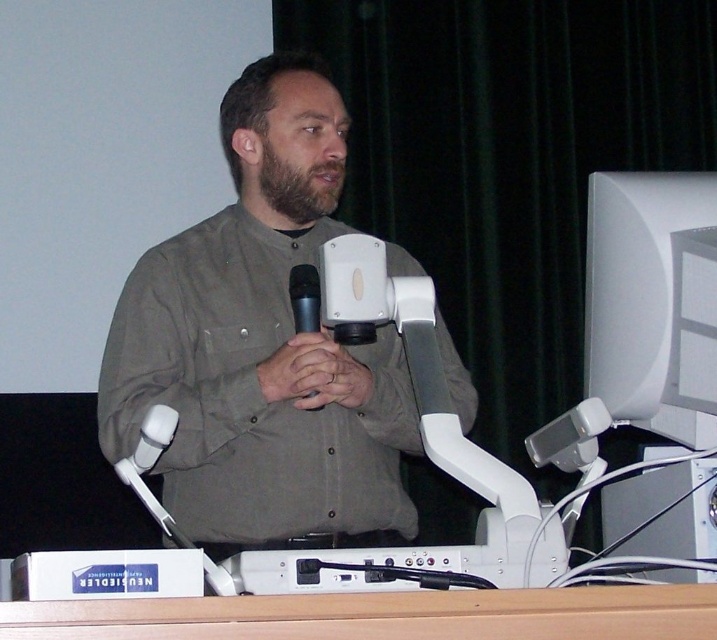
You are a photographer positioned behind the man at the podium. You want to take a closeup photo of the brown fuzzy beard at center and the black matte microphone at center. Can you fit both objects in the photo if your camera has a minimum focus distance of 10 inches?

The brown fuzzy beard at center is 9.76 inches away from the black matte microphone at center, so yes, both objects can fit in the photo since the distance between them is within the camera minimum focus distance of 10 inches.

You are a stagehand preparing to adjust the microphone stand. The microphone needs to be positioned exactly 12 inches away from the speaker. Currently, the white plastic microphone at lower left is 13.82 inches away from the matte gray shirt at center. Should you move the microphone closer to or farther away from the speaker?

The current distance between the white plastic microphone at lower left and the matte gray shirt at center is 13.82 inches. Since the required distance is 12 inches, you should move the microphone closer to the speaker to reduce the distance by 1.82 inches.

You are an event organizer checking the stage setup. You need to ensure that the matte gray shirt at center and the white plastic microphone at lower left are visible to the audience. Based on their sizes, which object is more likely to block the microphone from being seen?

The matte gray shirt at center might be wider than the white plastic microphone at lower left, so the matte gray shirt at center could potentially block the microphone from view if positioned in front of it.